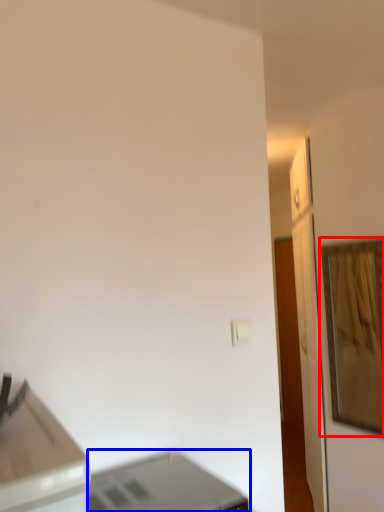
Question: Which object appears closest to the camera in this image, picture frame (highlighted by a red box) or printer (highlighted by a blue box)?

Choices:
 (A) picture frame
 (B) printer

Answer: (B)